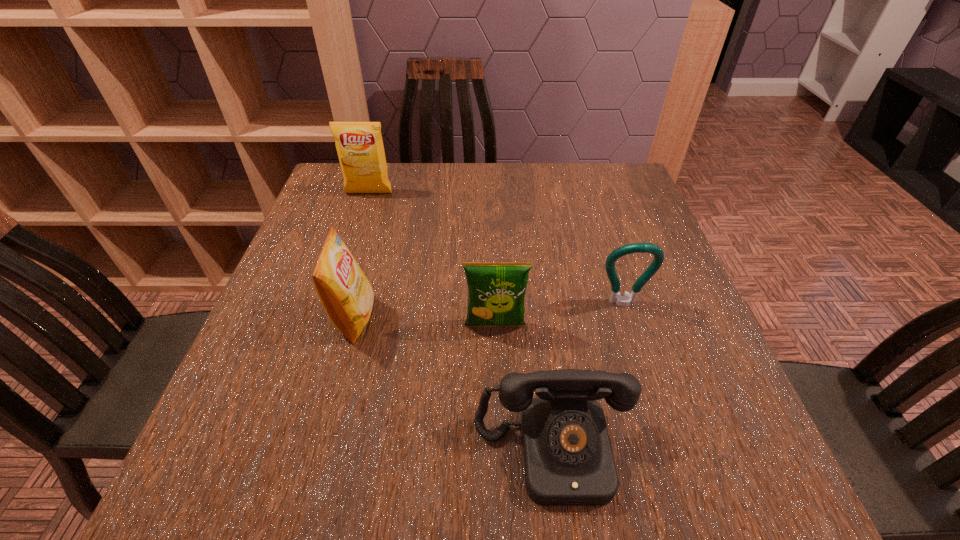
The image size is (960, 540). Identify the location of vacant area that lies between the farthest crisp (potato chip) and the rightmost crisp (potato chip). (432, 260).

You are a GUI agent. You are given a task and a screenshot of the screen. Output one action in this format:
    pyautogui.click(x=<x>, y=<y>)
    Task: Click on the blank region between the bottle opener and the rightmost crisp (potato chip)
    The image size is (960, 540).
    Given the screenshot: What is the action you would take?
    pyautogui.click(x=559, y=315)

This screenshot has height=540, width=960. I want to click on free space between the rightmost object and the farthest object, so click(495, 248).

Locate an element on the screen. The width and height of the screenshot is (960, 540). free point between the shortest object and the farthest crisp (potato chip) is located at coordinates (461, 323).

Where is `vacant space that is in between the shortest object and the farthest object`? vacant space that is in between the shortest object and the farthest object is located at coordinates (461, 323).

At what (x,y) coordinates should I click in order to perform the action: click on object that is the third closest one to the rightmost crisp (potato chip). Please return your answer as a coordinate pair (x, y). The image size is (960, 540). Looking at the image, I should click on (346, 295).

I want to click on the fourth closest object relative to the bottle opener, so [359, 145].

This screenshot has height=540, width=960. In order to click on crisp (potato chip) that is the closest to the nearest object in this screenshot , I will do `click(496, 291)`.

The height and width of the screenshot is (540, 960). I want to click on crisp (potato chip) that stands as the closest to the farthest object, so click(x=346, y=295).